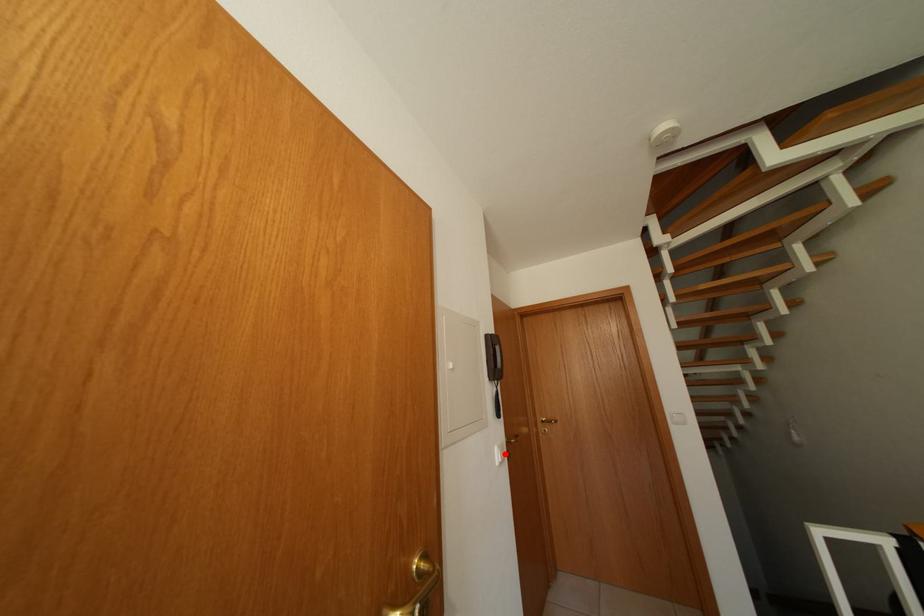
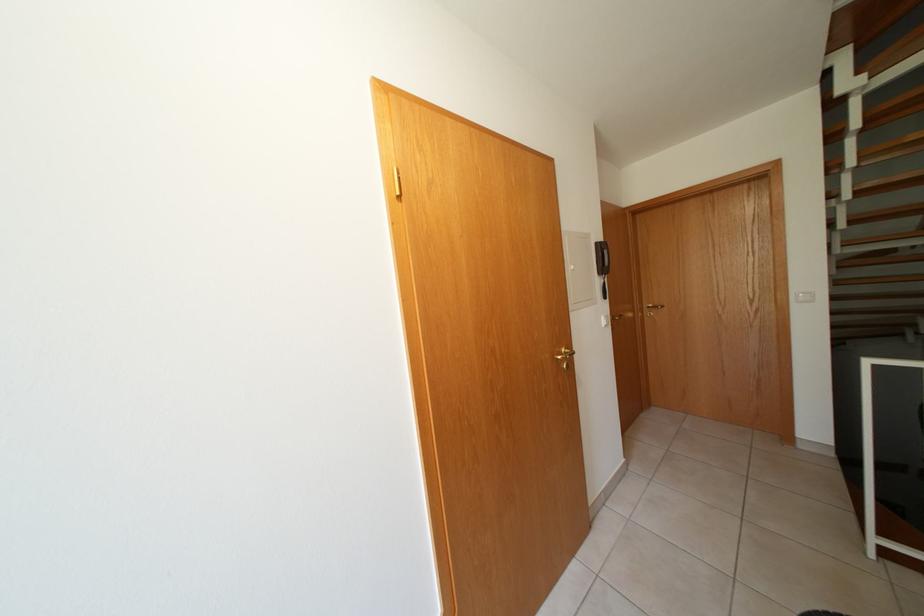
Where in the second image is the point corresponding to the highlighted location from the first image?

(611, 323)